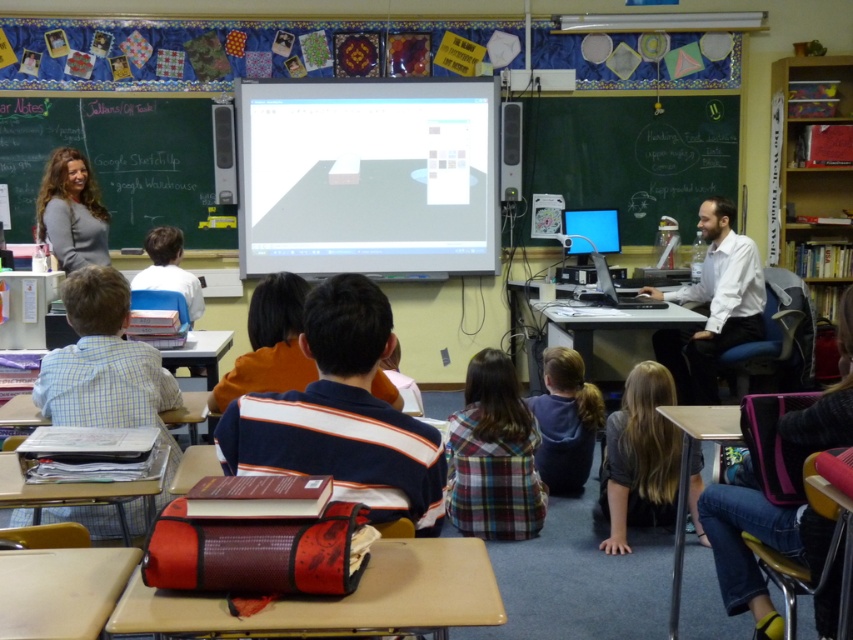
Consider the image. Which is above, green chalkboard at upper left or plaid fabric shirt at center?

Positioned higher is green chalkboard at upper left.

Between green chalkboard at upper left and plaid fabric shirt at center, which one appears on the right side from the viewer's perspective?

From the viewer's perspective, plaid fabric shirt at center appears more on the right side.

Find the location of `green chalkboard at upper left`. green chalkboard at upper left is located at coordinates (119, 163).

Find the location of a particular element. The height and width of the screenshot is (640, 853). green chalkboard at upper left is located at coordinates (119, 163).

Does dark gray shirt at lower center have a larger size compared to white shirt at right?

No.

Is dark gray shirt at lower center positioned at the back of white shirt at right?

No, it is in front of white shirt at right.

Between point (645, 413) and point (675, 384), which one is positioned in front?

Point (645, 413)

I want to click on dark gray shirt at lower center, so click(639, 458).

Can you confirm if white shirt at right is smaller than plaid fabric shirt at center?

Incorrect, white shirt at right is not smaller in size than plaid fabric shirt at center.

What do you see at coordinates (712, 305) in the screenshot?
I see `white shirt at right` at bounding box center [712, 305].

Is point (683, 396) closer to viewer compared to point (563, 484)?

No, it is behind (563, 484).

Identify the location of white shirt at right. (712, 305).